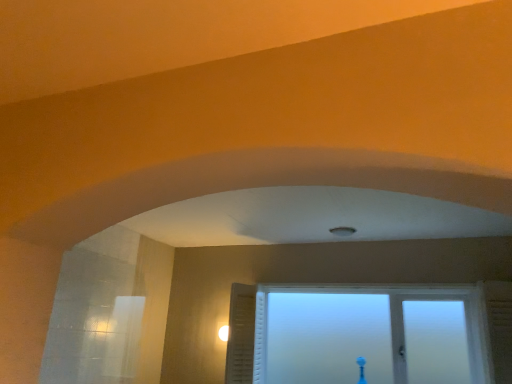
The width and height of the screenshot is (512, 384). What are the coordinates of `frosted glass window at center` in the screenshot? It's located at (359, 334).

What do you see at coordinates (359, 334) in the screenshot? This screenshot has height=384, width=512. I see `frosted glass window at center` at bounding box center [359, 334].

What is the approximate width of frosted glass window at center?

27.25 centimeters.

The width and height of the screenshot is (512, 384). Identify the location of frosted glass window at center. (359, 334).